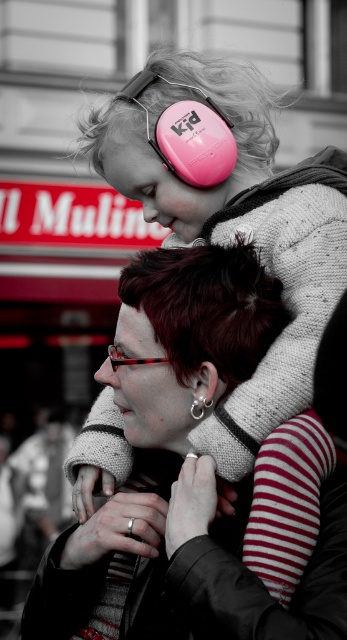
You are an artist trying to sketch the scene. You notice the dark red hair at center and the translucent red glasses at center. Which object should you draw first if you want to start with the wider one?

The dark red hair at center should be drawn first because its width is larger than the translucent red glasses at center.

You are an observer looking at the scene. The scene has a matte black jacket at center and a translucent red glasses at center. Which object is closer to you?

The matte black jacket at center is closer to you because it is in front of the translucent red glasses at center.

You are a photographer who wants to capture a closeup of the pink matte ear protection at upper center in the image. Based on its position, where should you focus your camera? Please provide the coordinates in the format of a point like this example format of point coordinates like this example format of point coordinates like this example format of point coordinates like this example format of point coordinates like this example format of point coordinates like this example format of point coordinates like

The pink matte ear protection at upper center is located at point coordinates like this example format of point coordinates like this example format of point coordinates like this example format of point coordinates like this example format of point coordinates like this example format of point coordinates like this example format of point coordinates like this example format of point coordinates like this example format of point coordinates like this example format of point coordinates like this example. 0